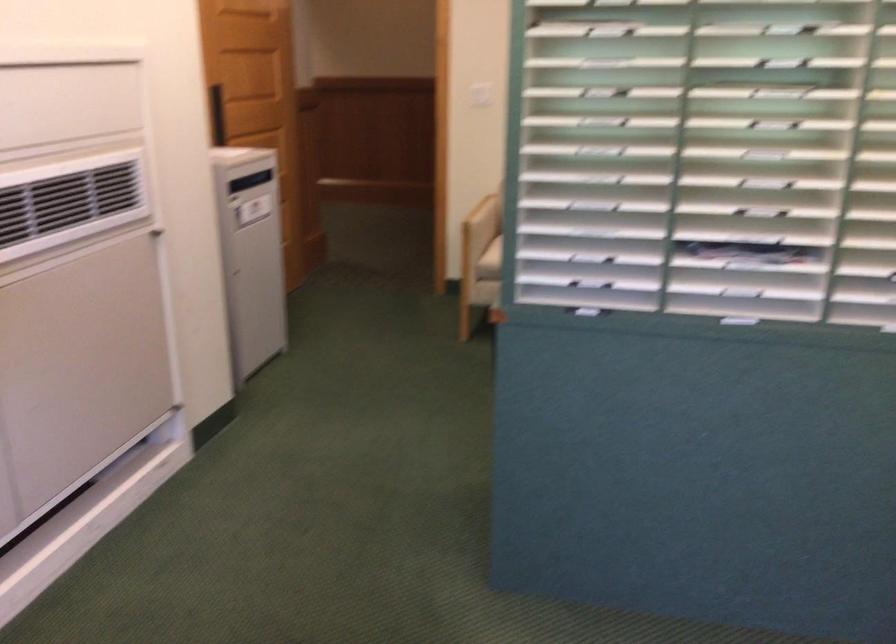
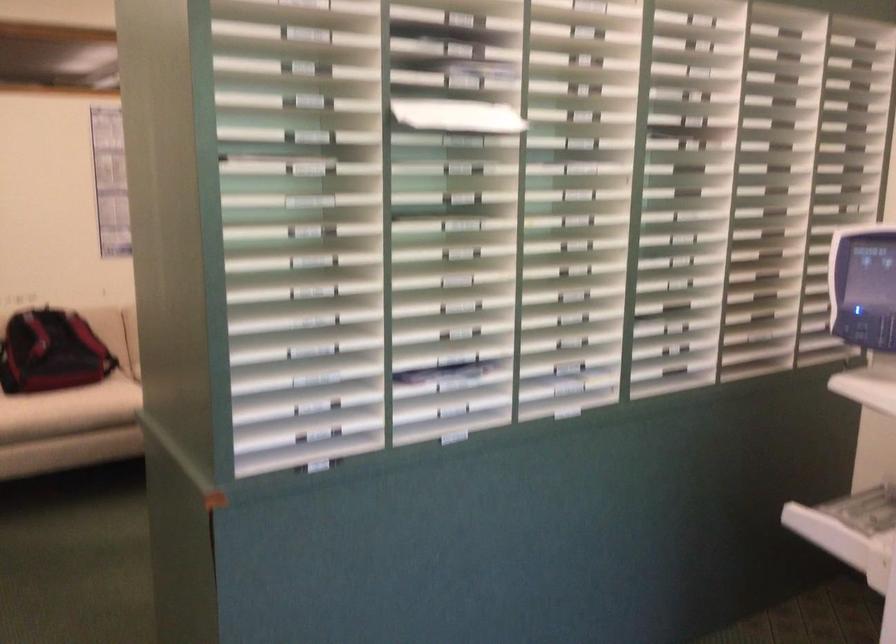
Question: The camera is either moving clockwise (left) or counter-clockwise (right) around the object. The first image is from the beginning of the video and the second image is from the end. Is the camera moving left or right when shooting the video?

Choices:
 (A) Left
 (B) Right

Answer: (A)